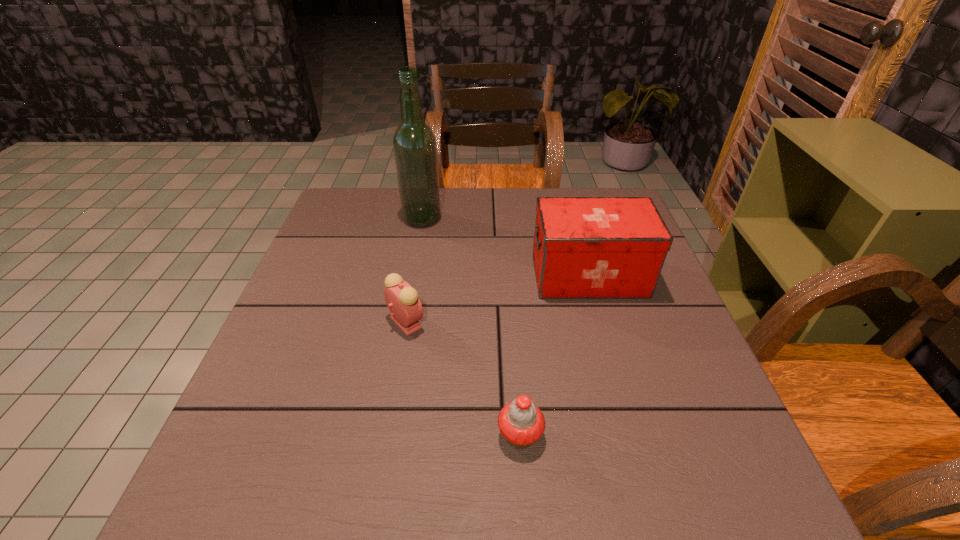
At what (x,y) coordinates should I click in order to perform the action: click on vacant space that is in between the third shortest object and the farthest object. Please return your answer as a coordinate pair (x, y). The height and width of the screenshot is (540, 960). Looking at the image, I should click on (506, 247).

Identify the location of blank region between the alarm clock and the farthest object. (414, 271).

Identify which object is the second closest to the alarm clock. Please provide its 2D coordinates. Your answer should be formatted as a tuple, i.e. [(x, y)], where the tuple contains the x and y coordinates of a point satisfying the conditions above.

[(584, 247)]

Identify which object is the second nearest to the second object from right to left. Please provide its 2D coordinates. Your answer should be formatted as a tuple, i.e. [(x, y)], where the tuple contains the x and y coordinates of a point satisfying the conditions above.

[(584, 247)]

This screenshot has width=960, height=540. In order to click on vacant area that satisfies the following two spatial constraints: 1. on the face of the alarm clock; 2. on the right side of the cupcake in this screenshot , I will do `click(387, 435)`.

Identify the location of free space in the image that satisfies the following two spatial constraints: 1. on the handle side of the second tallest object; 2. on the front side of the third object from left to right. (635, 435).

The height and width of the screenshot is (540, 960). I want to click on vacant area in the image that satisfies the following two spatial constraints: 1. on the back side of the cupcake; 2. on the face of the second nearest object, so click(512, 322).

Identify the location of free location that satisfies the following two spatial constraints: 1. on the front side of the third object from left to right; 2. on the right side of the liquor. The height and width of the screenshot is (540, 960). (384, 435).